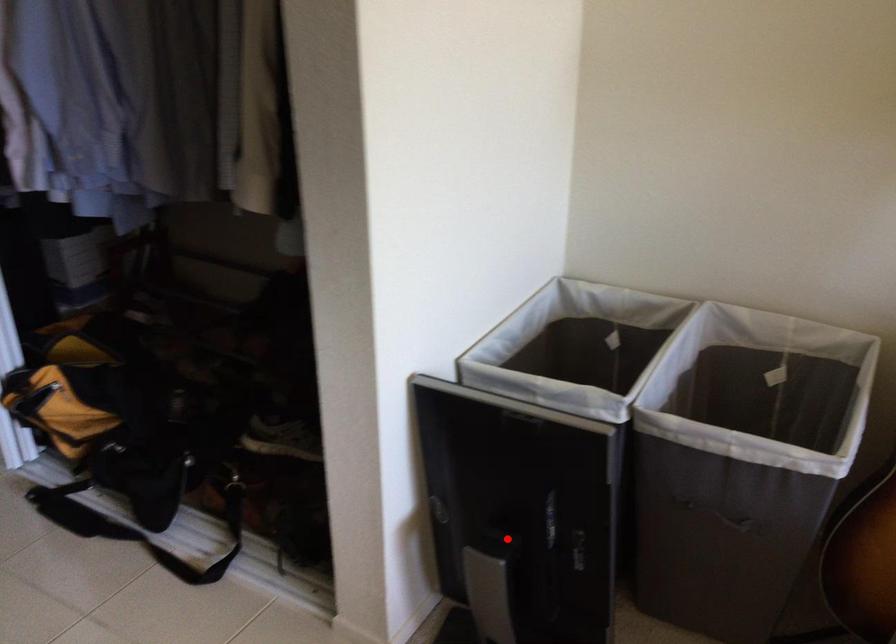
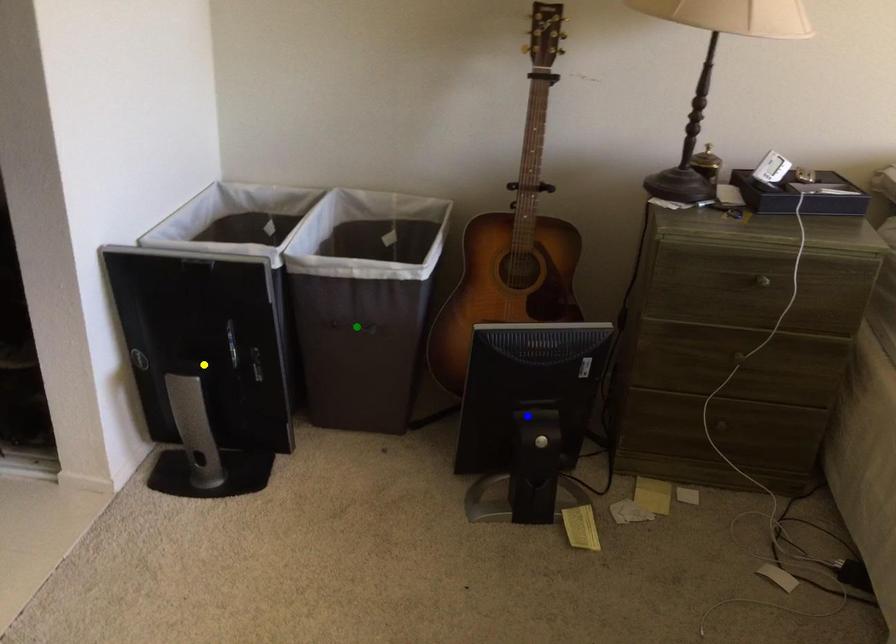
Question: I am providing you with two images of the same scene from different viewpoints. A red point is marked on the first image. You are given multiple points on the second image. In image 2, which mark is for the same physical point as the one in image 1?

Choices:
 (A) yellow point
 (B) green point
 (C) blue point

Answer: (A)